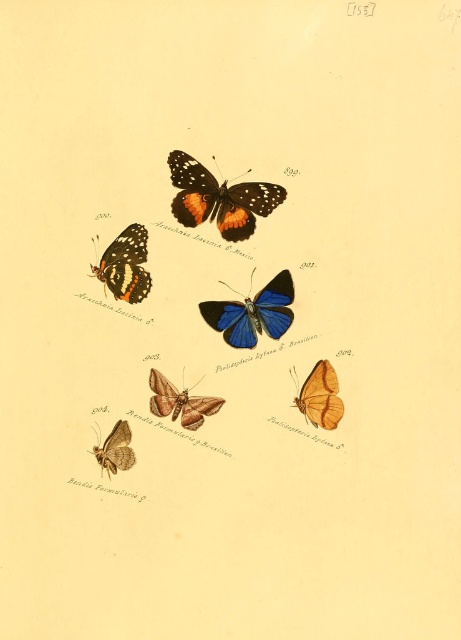
Is blue glossy butterfly at center to the left of matte brown moth at lower left from the viewer's perspective?

In fact, blue glossy butterfly at center is to the right of matte brown moth at lower left.

Is blue glossy butterfly at center bigger than matte brown moth at lower left?

Correct, blue glossy butterfly at center is larger in size than matte brown moth at lower left.

Image resolution: width=461 pixels, height=640 pixels. In order to click on blue glossy butterfly at center in this screenshot , I will do `click(253, 314)`.

Who is positioned more to the right, brown matte moth at center or matte brown moth at lower left?

brown matte moth at center

Is brown matte moth at center wider than matte brown moth at lower left?

Correct, the width of brown matte moth at center exceeds that of matte brown moth at lower left.

This screenshot has height=640, width=461. In order to click on brown matte moth at center in this screenshot , I will do `click(179, 403)`.

Who is positioned more to the left, orange and black butterfly at center or brown matte moth at center?

brown matte moth at center

Is orange and black butterfly at center taller than brown matte moth at center?

Yes, orange and black butterfly at center is taller than brown matte moth at center.

Between point (172, 208) and point (194, 396), which one is positioned behind?

Point (172, 208)

Image resolution: width=461 pixels, height=640 pixels. In order to click on orange and black butterfly at center in this screenshot , I will do `click(218, 198)`.